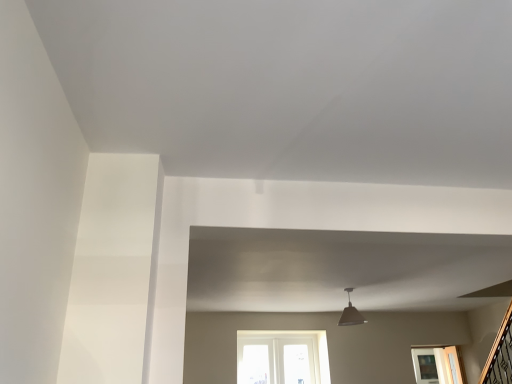
The height and width of the screenshot is (384, 512). Describe the element at coordinates (437, 365) in the screenshot. I see `clear glass cabinet at lower right` at that location.

The width and height of the screenshot is (512, 384). In order to click on clear glass cabinet at lower right in this screenshot , I will do `click(437, 365)`.

Measure the distance between point (352, 320) and camera.

Point (352, 320) is 13.88 feet away from camera.

What do you see at coordinates (351, 314) in the screenshot?
I see `matte gray lampshade at upper center` at bounding box center [351, 314].

Where is `matte gray lampshade at upper center`? The width and height of the screenshot is (512, 384). matte gray lampshade at upper center is located at coordinates (351, 314).

In order to face matte gray lampshade at upper center, should I rotate leftwards or rightwards?

Rotate right and turn 12.628 degrees.

Identify the location of clear glass cabinet at lower right. Image resolution: width=512 pixels, height=384 pixels. (437, 365).

Visually, is clear glass cabinet at lower right positioned to the left or to the right of matte gray lampshade at upper center?

In the image, clear glass cabinet at lower right appears on the right side of matte gray lampshade at upper center.

Is the depth of clear glass cabinet at lower right less than that of matte gray lampshade at upper center?

No, it is not.

Does point (425, 372) appear closer or farther from the camera than point (349, 311)?

Point (425, 372).

From the image's perspective, does clear glass cabinet at lower right appear higher than matte gray lampshade at upper center?

No, from the image's perspective, clear glass cabinet at lower right is not on top of matte gray lampshade at upper center.

From a real-world perspective, relative to matte gray lampshade at upper center, is clear glass cabinet at lower right vertically above or below?

Clearly, from a real-world perspective, clear glass cabinet at lower right is below matte gray lampshade at upper center.

Based on the photo, which object is thinner, clear glass cabinet at lower right or matte gray lampshade at upper center?

matte gray lampshade at upper center.

Considering the sizes of clear glass cabinet at lower right and matte gray lampshade at upper center in the image, is clear glass cabinet at lower right taller or shorter than matte gray lampshade at upper center?

Considering their sizes, clear glass cabinet at lower right has more height than matte gray lampshade at upper center.

Considering the relative sizes of clear glass cabinet at lower right and matte gray lampshade at upper center in the image provided, is clear glass cabinet at lower right bigger than matte gray lampshade at upper center?

Yes.

Is clear glass cabinet at lower right spatially inside matte gray lampshade at upper center, or outside of it?

clear glass cabinet at lower right lies outside matte gray lampshade at upper center.

Is clear glass cabinet at lower right with matte gray lampshade at upper center?

No, clear glass cabinet at lower right is not beside matte gray lampshade at upper center.

Could you tell me if clear glass cabinet at lower right is facing matte gray lampshade at upper center?

No, clear glass cabinet at lower right is not aimed at matte gray lampshade at upper center.

Measure the distance between clear glass cabinet at lower right and matte gray lampshade at upper center.

clear glass cabinet at lower right is 2.00 meters away from matte gray lampshade at upper center.

The height and width of the screenshot is (384, 512). In the image, there is a matte gray lampshade at upper center. What are the coordinates of `window below it (from the image's perspective)` in the screenshot? It's located at (437, 365).

Considering the relative positions of matte gray lampshade at upper center and clear glass cabinet at lower right in the image provided, is matte gray lampshade at upper center to the left or to the right of clear glass cabinet at lower right?

In the image, matte gray lampshade at upper center appears on the left side of clear glass cabinet at lower right.

Is matte gray lampshade at upper center in front of or behind clear glass cabinet at lower right in the image?

In the image, matte gray lampshade at upper center appears in front of clear glass cabinet at lower right.

Is point (356, 312) positioned after point (433, 356)?

No, (356, 312) is closer to viewer.

From the image's perspective, who appears lower, matte gray lampshade at upper center or clear glass cabinet at lower right?

clear glass cabinet at lower right appears lower in the image.

From a real-world perspective, which is physically above, matte gray lampshade at upper center or clear glass cabinet at lower right?

In real-world perspective, matte gray lampshade at upper center is above.

Considering the relative sizes of matte gray lampshade at upper center and clear glass cabinet at lower right in the image provided, is matte gray lampshade at upper center wider than clear glass cabinet at lower right?

No, matte gray lampshade at upper center is not wider than clear glass cabinet at lower right.

Which of these two, matte gray lampshade at upper center or clear glass cabinet at lower right, stands shorter?

matte gray lampshade at upper center.

Considering the sizes of matte gray lampshade at upper center and clear glass cabinet at lower right in the image, is matte gray lampshade at upper center bigger or smaller than clear glass cabinet at lower right?

matte gray lampshade at upper center is smaller than clear glass cabinet at lower right.

Is matte gray lampshade at upper center outside of clear glass cabinet at lower right?

Yes, matte gray lampshade at upper center is located beyond the bounds of clear glass cabinet at lower right.

Is matte gray lampshade at upper center touching clear glass cabinet at lower right?

No, matte gray lampshade at upper center is not beside clear glass cabinet at lower right.

Could you tell me if matte gray lampshade at upper center is facing clear glass cabinet at lower right?

No, matte gray lampshade at upper center is not aimed at clear glass cabinet at lower right.

Can you tell me how much matte gray lampshade at upper center and clear glass cabinet at lower right differ in facing direction?

The angle between the facing direction of matte gray lampshade at upper center and the facing direction of clear glass cabinet at lower right is 172 degrees.

Locate an element on the screen. Image resolution: width=512 pixels, height=384 pixels. light fixture that appears above the clear glass cabinet at lower right (from a real-world perspective) is located at coordinates (351, 314).

Find the location of `light fixture above the clear glass cabinet at lower right (from a real-world perspective)`. light fixture above the clear glass cabinet at lower right (from a real-world perspective) is located at coordinates (351, 314).

You are a GUI agent. You are given a task and a screenshot of the screen. Output one action in this format:
    pyautogui.click(x=<x>, y=<y>)
    Task: Click on the window lying on the right of matte gray lampshade at upper center
    This screenshot has height=384, width=512.
    Given the screenshot: What is the action you would take?
    pyautogui.click(x=437, y=365)